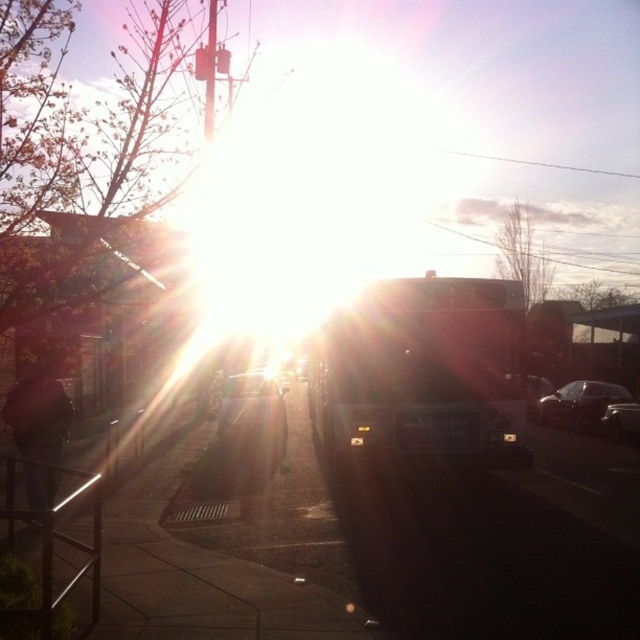
Question: Does metallic silver car at center appear under satin black car at right?

Choices:
 (A) yes
 (B) no

Answer: (A)

Question: Is metallic silver bus stop at lower left wider than metallic silver car at center?

Choices:
 (A) yes
 (B) no

Answer: (B)

Question: Which object appears closest to the camera in this image?

Choices:
 (A) metallic silver car at center
 (B) metallic silver bus stop at lower left
 (C) dark blue jeans at left
 (D) satin black car at right

Answer: (B)

Question: Among these objects, which one is nearest to the camera?

Choices:
 (A) metallic silver car at center
 (B) satin black car at right

Answer: (A)

Question: Based on their relative distances, which object is farther from the metallic silver car at center?

Choices:
 (A) metallic silver bus stop at lower left
 (B) shiny silver car at center
 (C) satin black car at right
 (D) dark blue jeans at left

Answer: (A)

Question: Does metallic silver bus stop at lower left appear under shiny silver car at center?

Choices:
 (A) no
 (B) yes

Answer: (A)